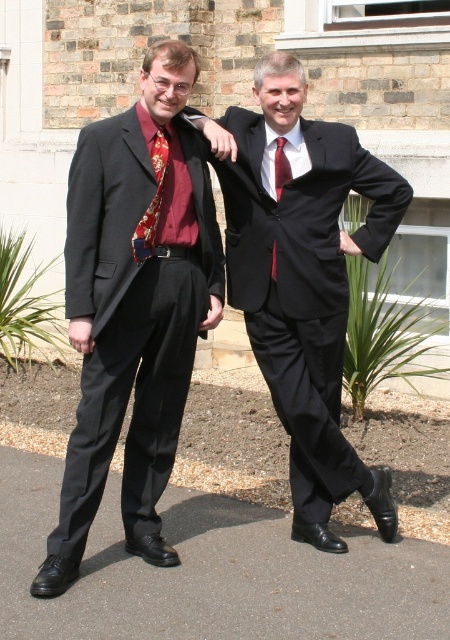
Question: Is matte black suit at center above silky red tie at center?

Choices:
 (A) yes
 (B) no

Answer: (B)

Question: Which object is positioned closest to the shiny silk tie at center?

Choices:
 (A) matte black suit at center
 (B) silky red tie at center
 (C) matte black suit at left

Answer: (C)

Question: Which point is closer to the camera?

Choices:
 (A) (138, 112)
 (B) (283, 125)

Answer: (A)

Question: Which point is closer to the camera?

Choices:
 (A) silky red tie at center
 (B) shiny silk tie at center

Answer: (B)

Question: Does matte black suit at center appear under shiny silk tie at center?

Choices:
 (A) no
 (B) yes

Answer: (B)

Question: Does matte black suit at left have a larger size compared to shiny silk tie at center?

Choices:
 (A) yes
 (B) no

Answer: (A)